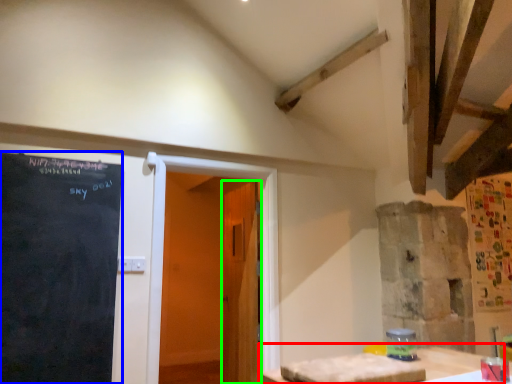
Question: Which object is the farthest from table (highlighted by a red box)? Choose among these: blackboard (highlighted by a blue box) or door (highlighted by a green box).

Choices:
 (A) blackboard
 (B) door

Answer: (A)